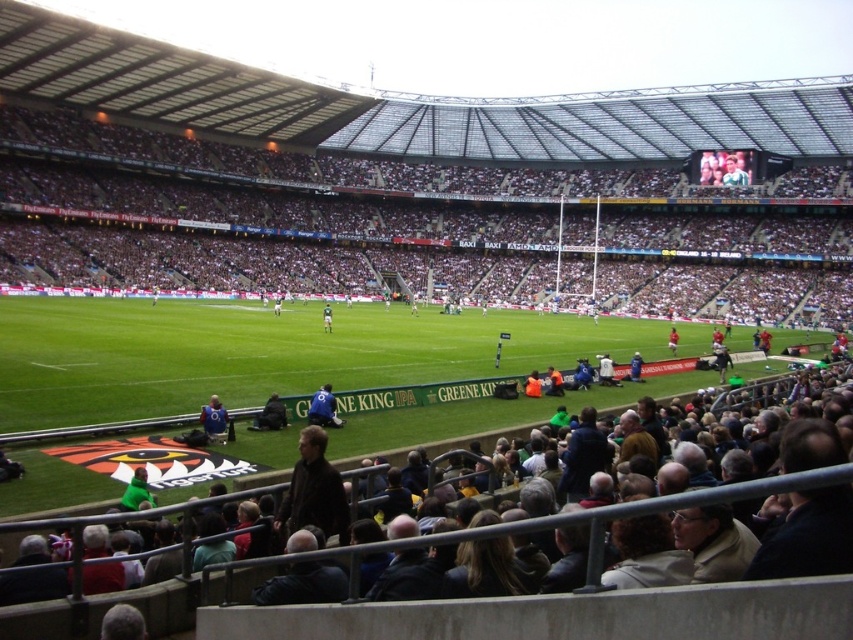
Based on the photo, is blue fabric jacket at lower center to the left of dark blue jacket at lower center from the viewer's perspective?

Indeed, blue fabric jacket at lower center is positioned on the left side of dark blue jacket at lower center.

Does point (228, 435) come closer to viewer compared to point (277, 406)?

Yes, it is in front of point (277, 406).

Based on the photo, who is more forward, (207,428) or (260,417)?

Point (207,428) is more forward.

Image resolution: width=853 pixels, height=640 pixels. Find the location of `blue fabric jacket at lower center`. blue fabric jacket at lower center is located at coordinates (215, 419).

Can you confirm if dark blue jacket at lower center is shorter than red jersey at center?

Yes, dark blue jacket at lower center is shorter than red jersey at center.

Is dark blue jacket at lower center taller than red jersey at center?

No, dark blue jacket at lower center is not taller than red jersey at center.

Find the location of `dark blue jacket at lower center`. dark blue jacket at lower center is located at coordinates (270, 416).

Who is more distant from viewer, (312,404) or (276,301)?

Positioned behind is point (276,301).

In order to click on blue jersey at center in this screenshot , I will do `click(323, 408)`.